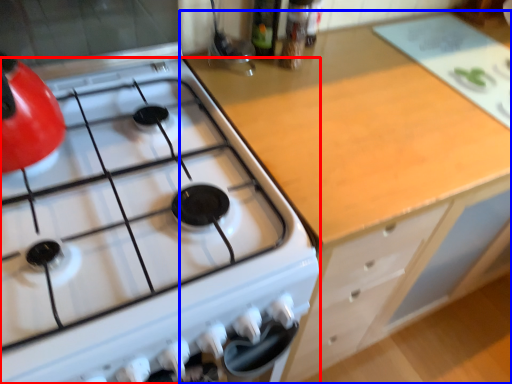
Question: Among these objects, which one is farthest to the camera, gas stove (highlighted by a red box) or cabinetry (highlighted by a blue box)?

Choices:
 (A) gas stove
 (B) cabinetry

Answer: (B)